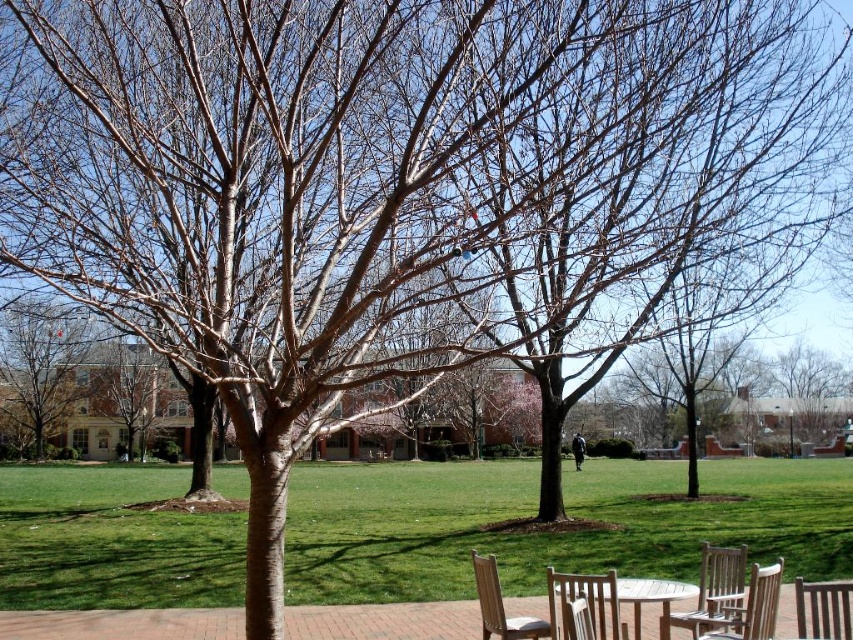
You are planning to host a small gathering in the park and need to seat 4 people. You have access to the brown wooden chair at lower right and the light brown wood picnic table at lower center. Which object can accommodate more people?

The brown wooden chair at lower right has a larger width than the light brown wood picnic table at lower center, so it can accommodate more people.